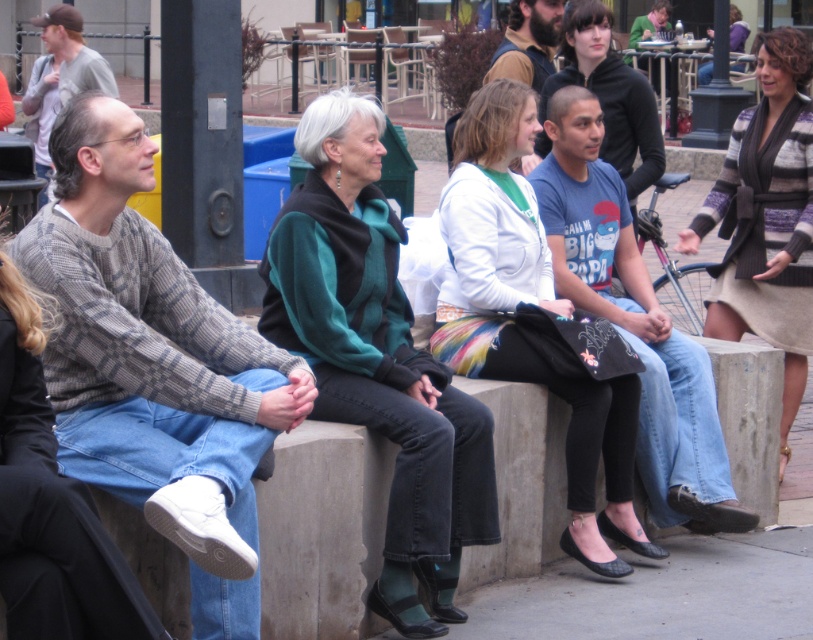
This screenshot has height=640, width=813. In order to click on blue cotton t-shirt at center in this screenshot , I will do `click(633, 321)`.

Looking at this image, measure the distance between point [685,394] and camera.

A distance of 8.55 meters exists between point [685,394] and camera.

Is point (572, 243) farther from camera compared to point (566, 33)?

No, it is in front of (566, 33).

You are a GUI agent. You are given a task and a screenshot of the screen. Output one action in this format:
    pyautogui.click(x=<x>, y=<y>)
    Task: Click on the blue cotton t-shirt at center
    
    Given the screenshot: What is the action you would take?
    pyautogui.click(x=633, y=321)

Which is more to the right, knit sweater at left or bearded man at center?

Positioned to the right is bearded man at center.

Does knit sweater at left have a greater width compared to bearded man at center?

Yes, knit sweater at left is wider than bearded man at center.

Does point (207, 538) come in front of point (515, 49)?

Yes, point (207, 538) is closer to viewer.

Identify the location of knit sweater at left. The image size is (813, 640). (154, 365).

Between gray cotton shirt at upper left and bearded man at center, which one is positioned higher?

gray cotton shirt at upper left is above.

Where is `gray cotton shirt at upper left`? gray cotton shirt at upper left is located at coordinates (59, 76).

Where is `gray cotton shirt at upper left`? Image resolution: width=813 pixels, height=640 pixels. gray cotton shirt at upper left is located at coordinates (59, 76).